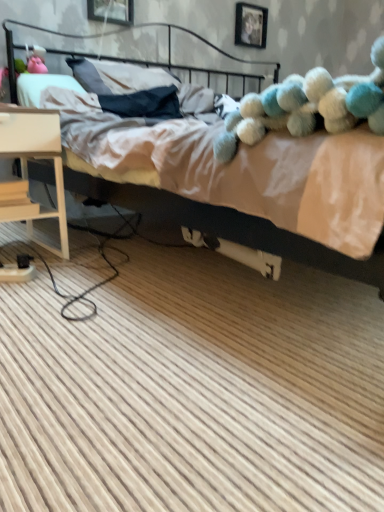
Question: From their relative heights in the image, would you say light wood nightstand at lower left is taller or shorter than black metal headboard at upper center?

Choices:
 (A) short
 (B) tall

Answer: (B)

Question: Is light wood nightstand at lower left in front of or behind black metal headboard at upper center in the image?

Choices:
 (A) behind
 (B) front

Answer: (B)

Question: Which is nearer to the fluffy blue and white teddy bear at upper right?

Choices:
 (A) black metal headboard at upper center
 (B) beige fabric bed at upper center
 (C) light wood nightstand at lower left

Answer: (C)

Question: Estimate the real-world distances between objects in this image. Which object is closer to the beige fabric bed at upper center?

Choices:
 (A) black metal headboard at upper center
 (B) light wood nightstand at lower left
 (C) fluffy blue and white teddy bear at upper right

Answer: (A)